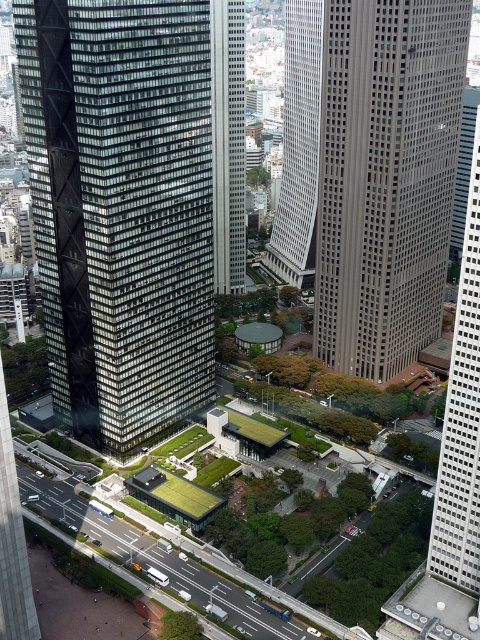
Is point (419, 323) farther from camera compared to point (441, 468)?

Yes, point (419, 323) is behind point (441, 468).

Which is below, gray concrete skyscraper at center or smooth glass skyscraper at right?

gray concrete skyscraper at center is lower down.

In order to click on gray concrete skyscraper at center in this screenshot , I will do `click(385, 177)`.

You are a GUI agent. You are given a task and a screenshot of the screen. Output one action in this format:
    pyautogui.click(x=<x>, y=<y>)
    Task: Click on the smooth glass skyscraper at right
    This screenshot has height=640, width=480.
    Given the screenshot: What is the action you would take?
    pyautogui.click(x=462, y=417)

Is point (444, 472) closer to camera compared to point (280, 253)?

Yes, point (444, 472) is closer to viewer.

The image size is (480, 640). Find the location of `smooth glass skyscraper at right`. smooth glass skyscraper at right is located at coordinates (462, 417).

Which is below, black glass skyscraper at center or smooth glass skyscraper at right?

black glass skyscraper at center

Between black glass skyscraper at center and smooth glass skyscraper at right, which one has less height?

black glass skyscraper at center

Which is behind, point (68, 282) or point (451, 426)?

The point (68, 282) is behind.

I want to click on black glass skyscraper at center, so click(128, 204).